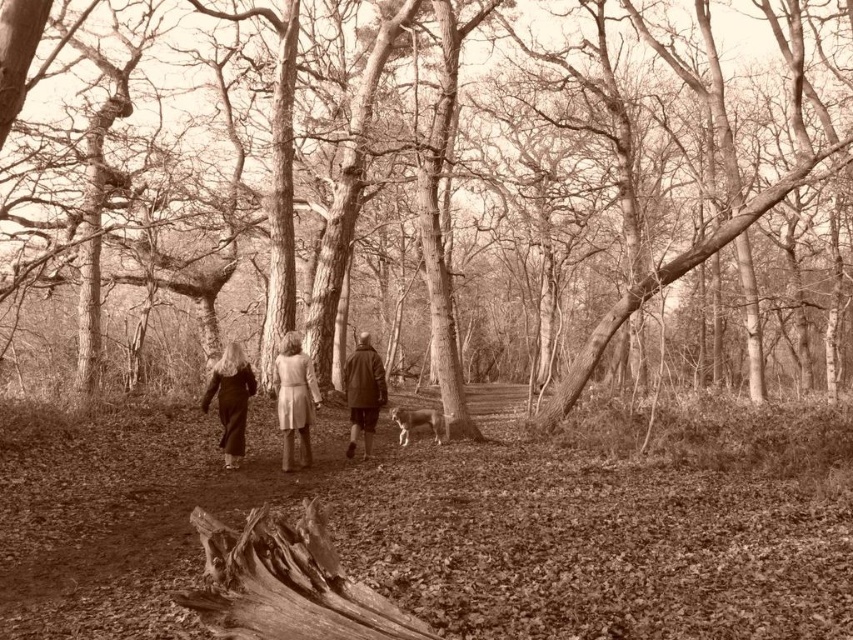
You are a photographer trying to capture a candid shot of the two people wearing the light brown wool coat at center and the dark brown leather jacket at center. Your camera has a maximum focus range of 36 inches. Can you get both subjects in focus at the same time?

The light brown wool coat at center and dark brown leather jacket at center are 38.56 inches apart, which exceeds the camera focus range of 36 inches. Therefore, you cannot get both in focus simultaneously.

You are standing at the point marked by the coordinates point [294,397]. Looking around, you see a light brown wool coat at center. Where is the light brown wool coat relative to your position?

The light brown wool coat at center is exactly at your current position, as you are standing at point [294,397] where it is located.